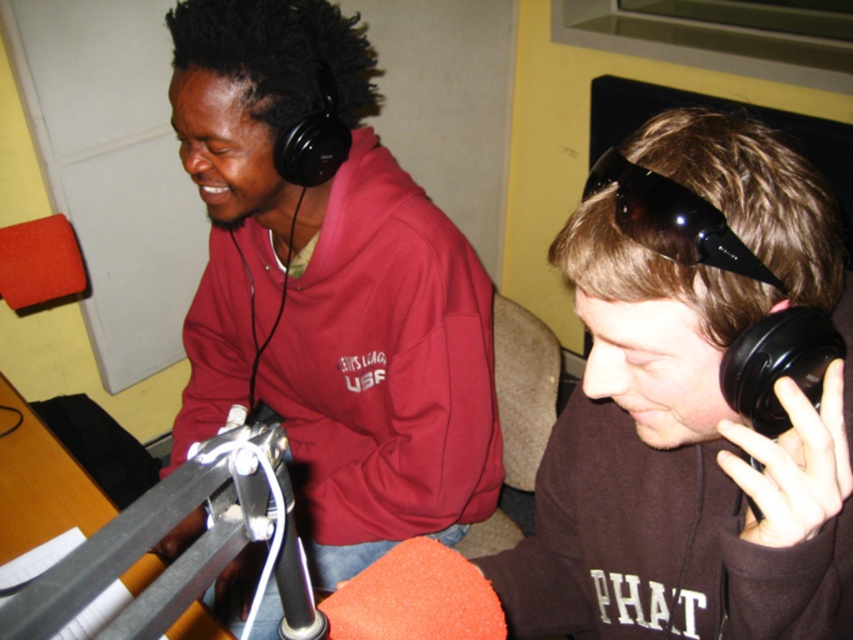
Question: Is matte black headphones at left bigger than black matte microphone at right?

Choices:
 (A) no
 (B) yes

Answer: (B)

Question: Which of the following is the closest to the observer?

Choices:
 (A) matte black headphones at left
 (B) brown matte hoodie at center
 (C) black shiny goggles at upper right
 (D) black matte microphone at right

Answer: (C)

Question: Which point is farther to the camera?

Choices:
 (A) (207, 196)
 (B) (672, 248)

Answer: (A)

Question: Is black shiny goggles at upper right bigger than black matte microphone at right?

Choices:
 (A) yes
 (B) no

Answer: (A)

Question: Is brown matte hoodie at center closer to the viewer compared to black shiny goggles at upper right?

Choices:
 (A) no
 (B) yes

Answer: (A)

Question: Which of the following is the closest to the observer?

Choices:
 (A) brown matte hoodie at center
 (B) black shiny goggles at upper right

Answer: (B)